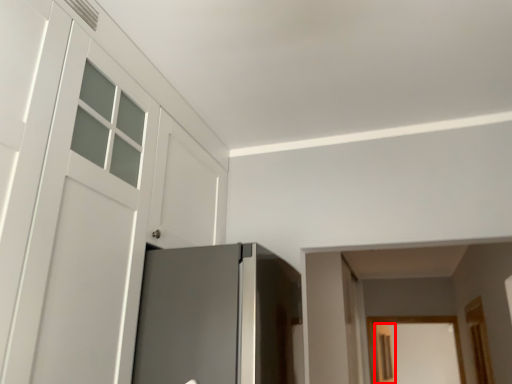
Question: Observing the image, what is the correct spatial positioning of screen door (annotated by the red box) in reference to door?

Choices:
 (A) left
 (B) right

Answer: (B)